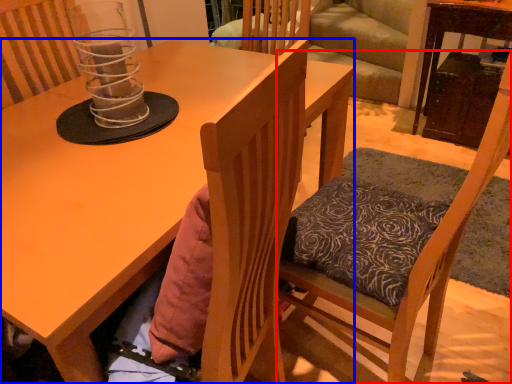
Question: Which point is further to the camera, chair (highlighted by a red box) or desk (highlighted by a blue box)?

Choices:
 (A) chair
 (B) desk

Answer: (B)